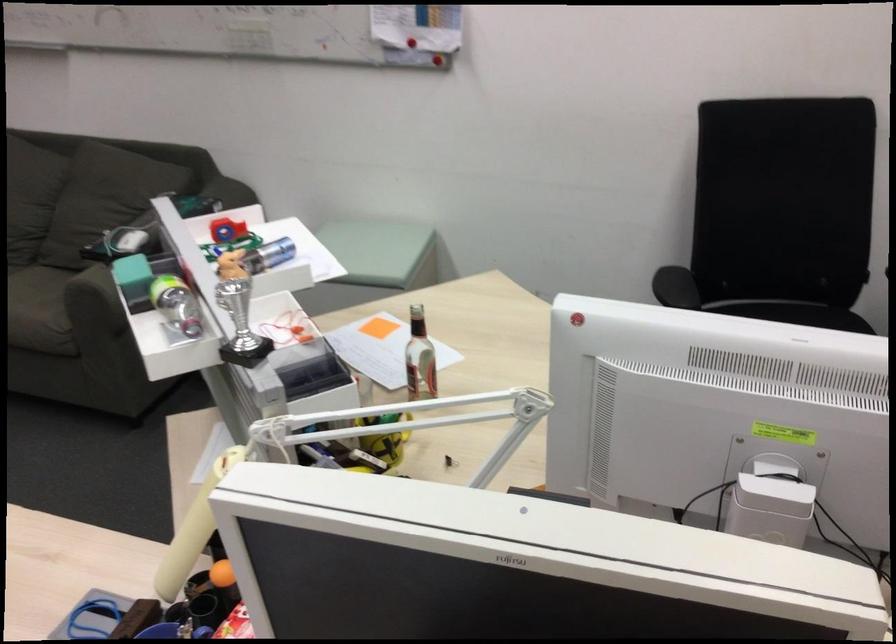
Where would you lift the small silver trophy? Please return your answer as a coordinate pair (x, y).

(240, 324)